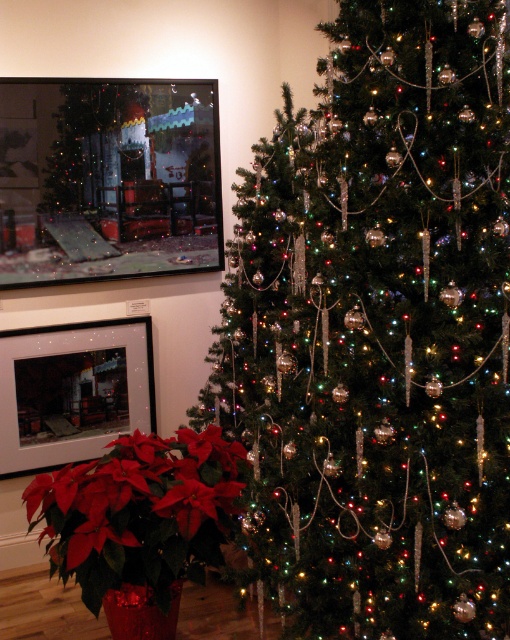
Question: Where is shiny metallic tree at center located in relation to red matte poinsettia at lower left in the image?

Choices:
 (A) below
 (B) above

Answer: (B)

Question: From the image, what is the correct spatial relationship of shiny metallic tree at center in relation to red matte poinsettia at lower left?

Choices:
 (A) above
 (B) below

Answer: (A)

Question: Which point is farther to the camera?

Choices:
 (A) (207, 472)
 (B) (420, 372)

Answer: (A)

Question: Observing the image, what is the correct spatial positioning of shiny metallic tree at center in reference to red matte poinsettia at lower left?

Choices:
 (A) right
 (B) left

Answer: (A)

Question: Among these points, which one is farthest from the camera?

Choices:
 (A) (376, 216)
 (B) (125, 540)

Answer: (B)